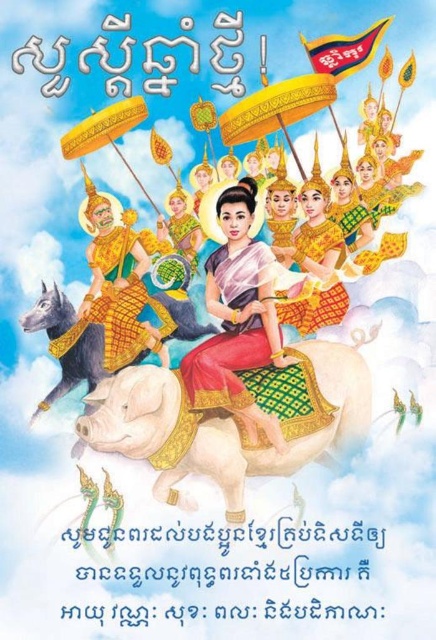
Question: Which point appears closest to the camera in this image?

Choices:
 (A) (123, 416)
 (B) (115, 285)

Answer: (A)

Question: Can you confirm if gold textured armor at center is thinner than dark gray matte horse at center?

Choices:
 (A) yes
 (B) no

Answer: (A)

Question: Does white textured horse at center lie in front of gold textured armor at center?

Choices:
 (A) no
 (B) yes

Answer: (B)

Question: Considering the relative positions of white textured horse at center and gold textured armor at center in the image provided, where is white textured horse at center located with respect to gold textured armor at center?

Choices:
 (A) below
 (B) above

Answer: (A)

Question: Among these points, which one is nearest to the camera?

Choices:
 (A) (173, 388)
 (B) (88, 355)
 (C) (133, 358)

Answer: (A)

Question: Which point is farther to the camera?

Choices:
 (A) silk fabric woman at center
 (B) dark gray matte horse at center
 (C) gold textured armor at center

Answer: (C)